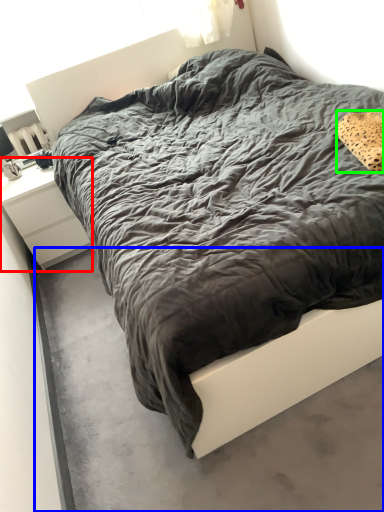
Question: Based on their relative distances, which object is nearer to nightstand (highlighted by a red box)? Choose from concrete (highlighted by a blue box) and pillow (highlighted by a green box).

Choices:
 (A) concrete
 (B) pillow

Answer: (A)